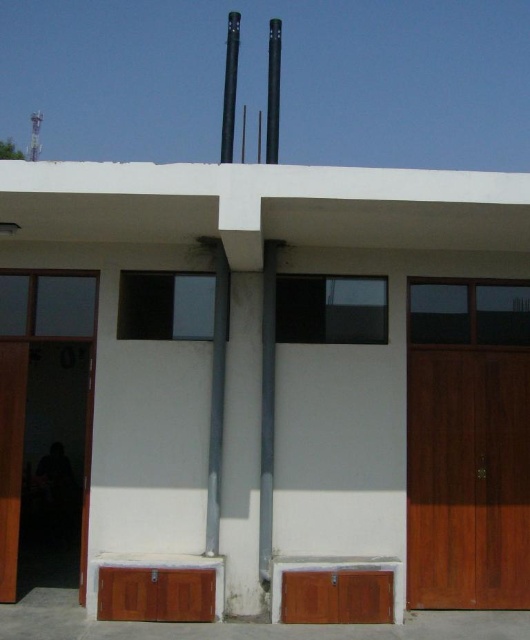
You are standing in front of the building and want to locate two specific points marked on the image. The first point is at coordinates point [453,353] and the second is at point [24,372]. Which point appears closer to you?

Point [453,353] is further to the viewer than point [24,372], so the point at [24,372] is closer to you.

You are standing in front of a building with two wooden doors. The wooden door at right and the wooden door at left. Which door is located to the right side of the other?

The wooden door at right is positioned on the right side of wooden door at left.

You are standing in front of the building and want to enter through one of the doors. The wooden door at right and wooden door at left are both visible. Which door should you approach first if you want to reach the one closer to you?

You should approach the wooden door at right first because it is closer to you than the wooden door at left.